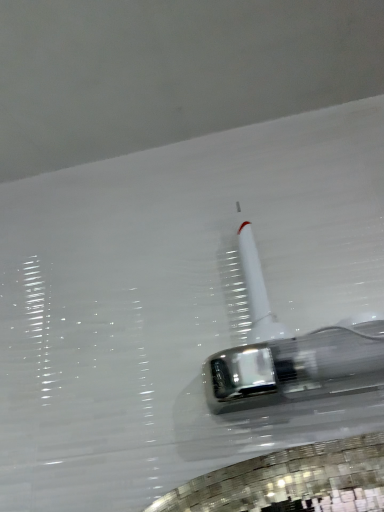
What do you see at coordinates (279, 342) in the screenshot? Image resolution: width=384 pixels, height=512 pixels. I see `metallic silver car at center` at bounding box center [279, 342].

Find the location of a particular element. Image resolution: width=384 pixels, height=512 pixels. metallic silver car at center is located at coordinates (279, 342).

I want to click on metallic silver car at center, so click(279, 342).